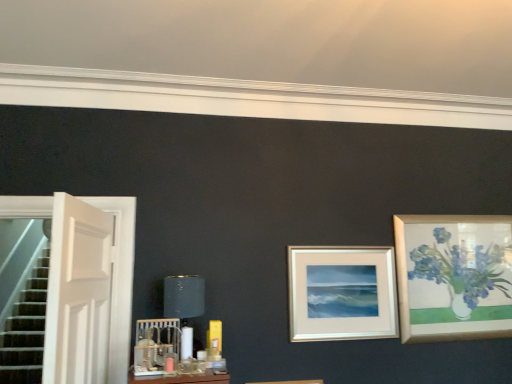
You are a GUI agent. You are given a task and a screenshot of the screen. Output one action in this format:
    pyautogui.click(x=<x>, y=<y>)
    Task: Click on the silver/metallic picture frame at center
    Image resolution: width=512 pixels, height=384 pixels.
    Given the screenshot: What is the action you would take?
    pyautogui.click(x=342, y=293)

The width and height of the screenshot is (512, 384). What are the coordinates of `silver/metallic picture frame at center` in the screenshot? It's located at (342, 293).

Considering the relative sizes of white wooden door at left and silver/metallic picture frame at center in the image provided, is white wooden door at left wider than silver/metallic picture frame at center?

Yes, white wooden door at left is wider than silver/metallic picture frame at center.

Relative to silver/metallic picture frame at center, is white wooden door at left in front or behind?

Clearly, white wooden door at left is in front of silver/metallic picture frame at center.

Is silver/metallic picture frame at center located within white wooden door at left?

Actually, silver/metallic picture frame at center is outside white wooden door at left.

In the scene shown: From a real-world perspective, which is physically above, white wooden door at left or silver/metallic picture frame at center?

white wooden door at left, from a real-world perspective.

You are a GUI agent. You are given a task and a screenshot of the screen. Output one action in this format:
    pyautogui.click(x=<x>, y=<y>)
    Task: Click on the table lamp below the silver/metallic picture frame at center (from the image's perspective)
    This screenshot has width=512, height=384.
    Given the screenshot: What is the action you would take?
    pyautogui.click(x=184, y=305)

How different are the orientations of silver/metallic picture frame at center and matte black lampshade at center in degrees?

They differ by 0.546 degrees in their facing directions.

From the image's perspective, is silver/metallic picture frame at center positioned above or below matte black lampshade at center?

Based on their image positions, silver/metallic picture frame at center is located above matte black lampshade at center.

Which is more to the right, silver/metallic picture frame at center or matte black lampshade at center?

silver/metallic picture frame at center.

Can you confirm if white wooden door at left is positioned to the right of matte black lampshade at center?

In fact, white wooden door at left is to the left of matte black lampshade at center.

From a real-world perspective, is white wooden door at left above or below matte black lampshade at center?

white wooden door at left is above matte black lampshade at center.

Is point (66, 264) behind point (197, 307)?

No.

From the image's perspective, which one is positioned higher, white wooden door at left or matte black lampshade at center?

white wooden door at left.

In the scene shown: Is matte black lampshade at center not within silver/metallic picture frame at center?

Yes, matte black lampshade at center is located beyond the bounds of silver/metallic picture frame at center.

At what (x,y) coordinates should I click in order to perform the action: click on picture frame behind the matte black lampshade at center. Please return your answer as a coordinate pair (x, y). This screenshot has height=384, width=512. Looking at the image, I should click on (342, 293).

How many degrees apart are the facing directions of matte black lampshade at center and silver/metallic picture frame at center?

The angular difference between matte black lampshade at center and silver/metallic picture frame at center is 0.546 degrees.

Is point (191, 292) positioned behind point (364, 284)?

No, it is in front of (364, 284).

What's the angular difference between silver/metallic picture frame at center and white wooden door at left's facing directions?

There is a 83.9-degree angle between the facing directions of silver/metallic picture frame at center and white wooden door at left.

How much distance is there between silver/metallic picture frame at center and white wooden door at left?

1.48 meters.

Which is in front, point (391, 261) or point (105, 227)?

Positioned in front is point (105, 227).

Is the position of silver/metallic picture frame at center less distant than that of white wooden door at left?

No, it is behind white wooden door at left.

Is matte black lampshade at center bigger or smaller than white wooden door at left?

matte black lampshade at center is smaller than white wooden door at left.

Is matte black lampshade at center surrounding white wooden door at left?

No, white wooden door at left is located outside of matte black lampshade at center.

From a real-world perspective, between matte black lampshade at center and white wooden door at left, who is vertically lower?

matte black lampshade at center, from a real-world perspective.

From the image's perspective, relative to white wooden door at left, is matte black lampshade at center above or below?

From the image's perspective, matte black lampshade at center appears below white wooden door at left.

This screenshot has width=512, height=384. Identify the location of picture frame that appears behind the white wooden door at left. (342, 293).

Where is `table lamp in front of the silver/metallic picture frame at center`? table lamp in front of the silver/metallic picture frame at center is located at coordinates (184, 305).

Estimate the real-world distances between objects in this image. Which object is closer to matte black lampshade at center, silver/metallic picture frame at center or white wooden door at left?

Among the two, white wooden door at left is located nearer to matte black lampshade at center.

Based on their spatial positions, is white wooden door at left or matte black lampshade at center closer to silver/metallic picture frame at center?

Based on the image, matte black lampshade at center appears to be nearer to silver/metallic picture frame at center.

Considering their positions, is silver/metallic picture frame at center positioned further to white wooden door at left than matte black lampshade at center?

silver/metallic picture frame at center lies further to white wooden door at left than the other object.

From the image, which object appears to be nearer to white wooden door at left, matte black lampshade at center or silver/metallic picture frame at center?

matte black lampshade at center lies closer to white wooden door at left than the other object.

From the image, which object appears to be nearer to matte black lampshade at center, white wooden door at left or silver/metallic picture frame at center?

Based on the image, white wooden door at left appears to be nearer to matte black lampshade at center.

Based on their spatial positions, is matte black lampshade at center or white wooden door at left further from silver/metallic picture frame at center?

white wooden door at left is positioned further to the anchor silver/metallic picture frame at center.

I want to click on table lamp located between white wooden door at left and silver/metallic picture frame at center in the left-right direction, so click(x=184, y=305).